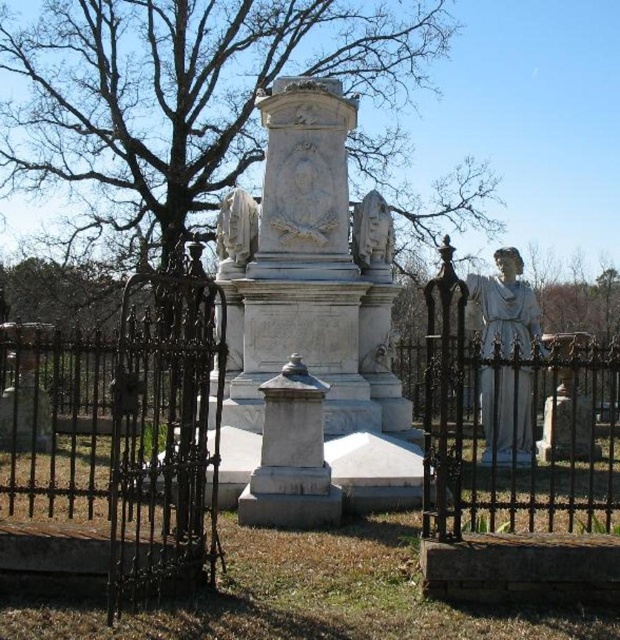
This screenshot has width=620, height=640. Describe the element at coordinates (505, 307) in the screenshot. I see `white marble statue at right` at that location.

Is point (520, 346) farther from viewer compared to point (249, 204)?

No, it is not.

Is point (510, 413) closer to camera compared to point (228, 236)?

Yes.

Find the location of a particular element. This screenshot has width=620, height=640. white marble statue at right is located at coordinates (505, 307).

Is white marble monument at center further to camera compared to white marble statue at right?

That is False.

Which is more to the left, white marble monument at center or white marble statue at right?

white marble monument at center

What do you see at coordinates (311, 272) in the screenshot? I see `white marble monument at center` at bounding box center [311, 272].

You are a GUI agent. You are given a task and a screenshot of the screen. Output one action in this format:
    pyautogui.click(x=<x>, y=<y>)
    Task: Click on the white marble monument at center
    
    Given the screenshot: What is the action you would take?
    pyautogui.click(x=311, y=272)

Who is positioned more to the right, black wrought iron fence at center or white marble statue at center?

black wrought iron fence at center is more to the right.

This screenshot has height=640, width=620. In order to click on black wrought iron fence at center in this screenshot , I will do `click(91, 461)`.

Locate an element on the screen. The width and height of the screenshot is (620, 640). black wrought iron fence at center is located at coordinates (91, 461).